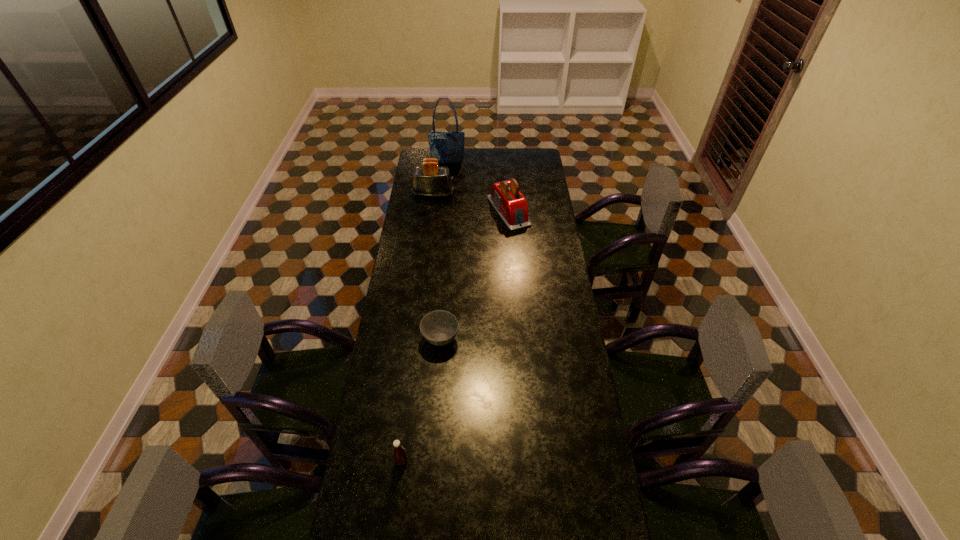
At what (x,y) coordinates should I click in order to perform the action: click on vacant position located on the front of the right toaster. Please return your answer as a coordinate pair (x, y). Image resolution: width=960 pixels, height=540 pixels. Looking at the image, I should click on (513, 270).

At what (x,y) coordinates should I click in order to perform the action: click on free space located 0.120m on the left of the nearest object. Please return your answer as a coordinate pair (x, y). The height and width of the screenshot is (540, 960). Looking at the image, I should click on [358, 461].

Identify the location of free space located on the left of the fourth farthest object. The width and height of the screenshot is (960, 540). (392, 339).

The image size is (960, 540). Identify the location of object that is positioned at the far edge. (447, 147).

Where is `shopping bag positioned at the left edge`? The width and height of the screenshot is (960, 540). shopping bag positioned at the left edge is located at coordinates (447, 147).

You are a GUI agent. You are given a task and a screenshot of the screen. Output one action in this format:
    pyautogui.click(x=<x>, y=<y>)
    Task: Click on the toaster at the left edge
    The height and width of the screenshot is (540, 960).
    Given the screenshot: What is the action you would take?
    pyautogui.click(x=430, y=180)

The image size is (960, 540). I want to click on Tabasco sauce that is at the left edge, so click(399, 452).

Where is `bowl at the left edge`? The width and height of the screenshot is (960, 540). bowl at the left edge is located at coordinates (439, 327).

Locate an element on the screen. This screenshot has width=960, height=540. object that is at the right edge is located at coordinates (507, 200).

I want to click on object located in the far left corner section of the desktop, so click(x=447, y=147).